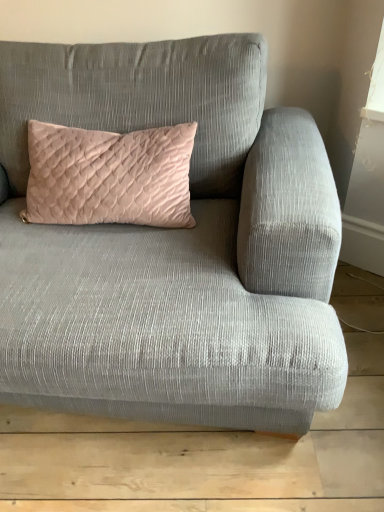
Where is `velvet gray couch at center`? velvet gray couch at center is located at coordinates (174, 247).

Describe the element at coordinates (174, 247) in the screenshot. I see `velvet gray couch at center` at that location.

At what (x,y) coordinates should I click in order to perform the action: click on velvet gray couch at center. Please return your answer as a coordinate pair (x, y). Looking at the image, I should click on (174, 247).